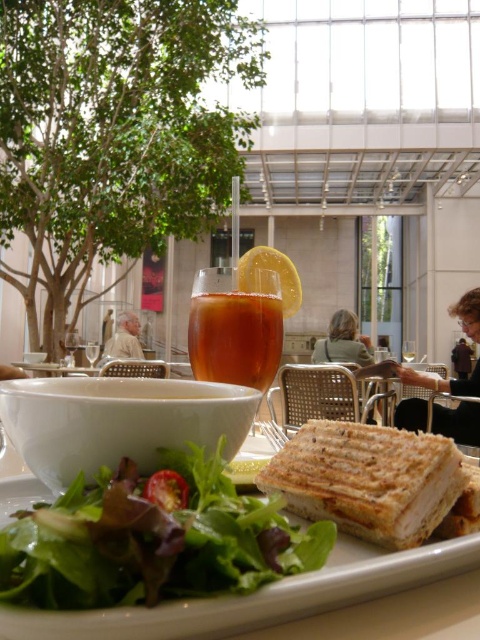
You are a delivery robot with a 6 inch wide package. You need to move from the entrance to the dining table. The entrance is located at point A and the dining table is at point B. The coordinates of point A and point B are given as point A at (248, 584) and point B at 0.823, 0.432. Can you fit through the path between them?

The distance between point A at (248, 584) and point B at 0.823, 0.432 is 5.95 inches. Since the package is 6 inches wide, it is slightly wider than the path. Therefore, the robot cannot fit through the path between them.

You are a food stylist arranging a photo shoot. You need to place a decorative hairpin on the matte brown hair at right so it doesn work with the green leafy salad at center. Which object should be wider to ensure the hairpin doesn interfere with the salad?

The matte brown hair at right should be wider than the green leafy salad at center to ensure the hairpin doesn interfere with the salad.

You are standing in the dining area and want to take a photo of both the plate of food and the glass of juice. The plate of food is at point (279, 538) and the glass of juice is at point (444, 419). Since you want both items to be clearly visible, which point should you focus on first to ensure the closest object is in focus?

You should focus on point (279, 538) first because it is closer to the camera than point (444, 419). This ensures the plate of food is in focus, and the glass of juice will also be in focus due to depth of field.